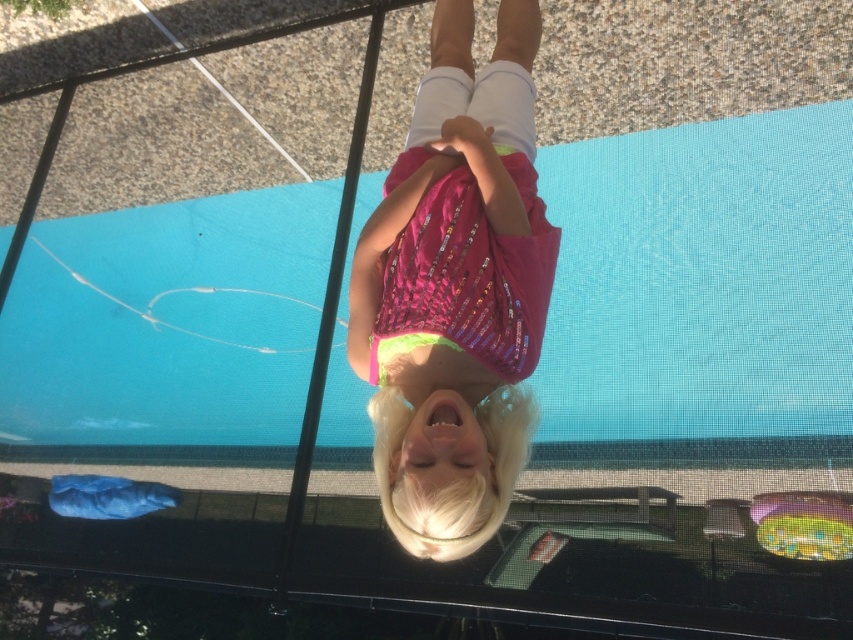
Looking at the trampoline scene, where is the blue rubber mat at center in relation to the pink sequined shirt at center?

The blue rubber mat at center is to the right of the pink sequined shirt at center.

You are a photographer trying to capture a photo of the blue rubber mat at center and the pink sequined shirt at center. Which object should you focus on first if you want to ensure both are in the frame without moving the camera?

The blue rubber mat at center is much taller than the pink sequined shirt at center, so you should focus on the blue rubber mat at center first to ensure both are in frame.